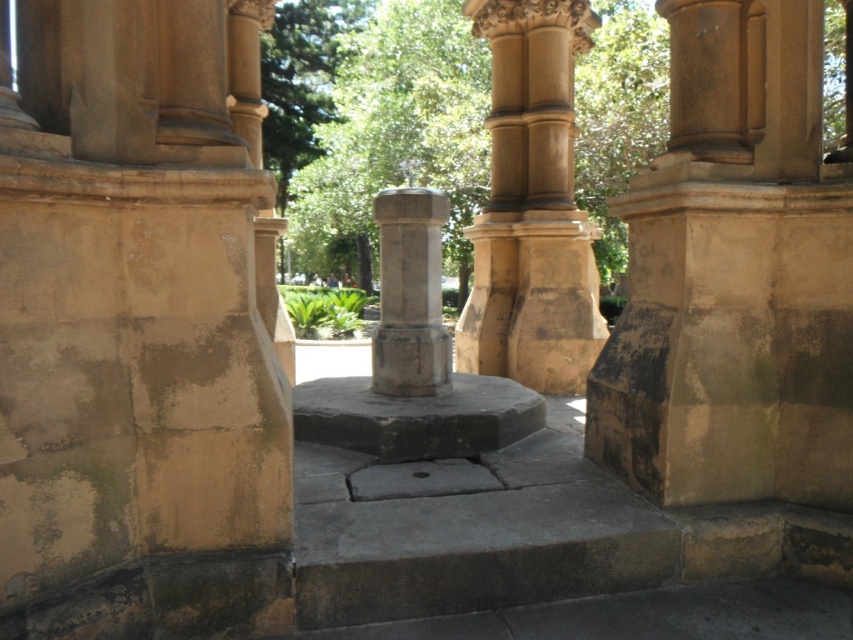
Question: Does dark gray stone pedestal at center appear on the right side of stone column at center?

Choices:
 (A) no
 (B) yes

Answer: (A)

Question: Which point appears farthest from the camera in this image?

Choices:
 (A) (462, 321)
 (B) (408, 332)

Answer: (A)

Question: Which point is farther to the camera?

Choices:
 (A) click(x=577, y=220)
 (B) click(x=474, y=445)
 (C) click(x=432, y=241)

Answer: (A)

Question: Can you confirm if matte stone column at center is smaller than stone column at center?

Choices:
 (A) no
 (B) yes

Answer: (A)

Question: Among these points, which one is farthest from the camera?

Choices:
 (A) click(x=529, y=48)
 (B) click(x=514, y=403)

Answer: (A)

Question: Can you confirm if dark gray stone pedestal at center is bigger than stone column at center?

Choices:
 (A) yes
 (B) no

Answer: (A)